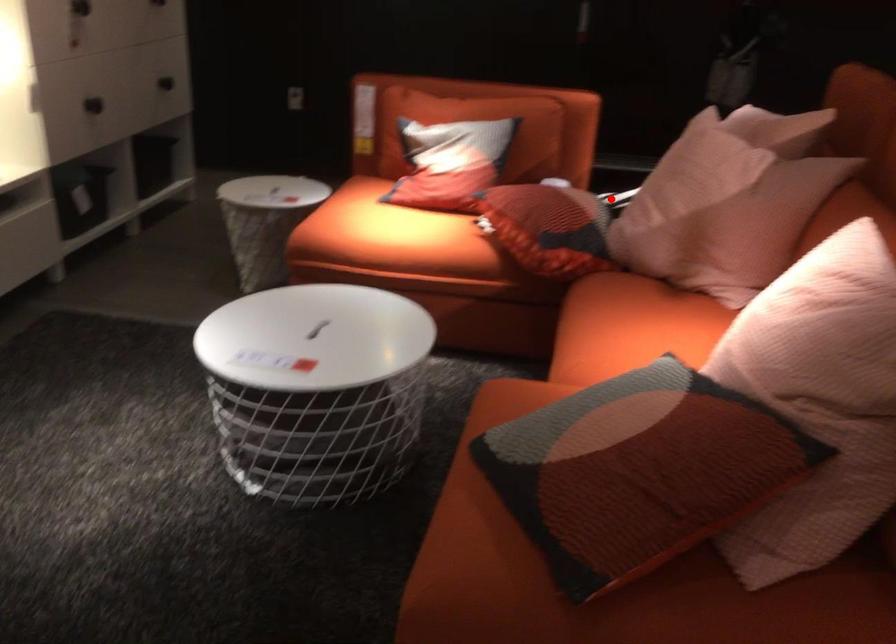
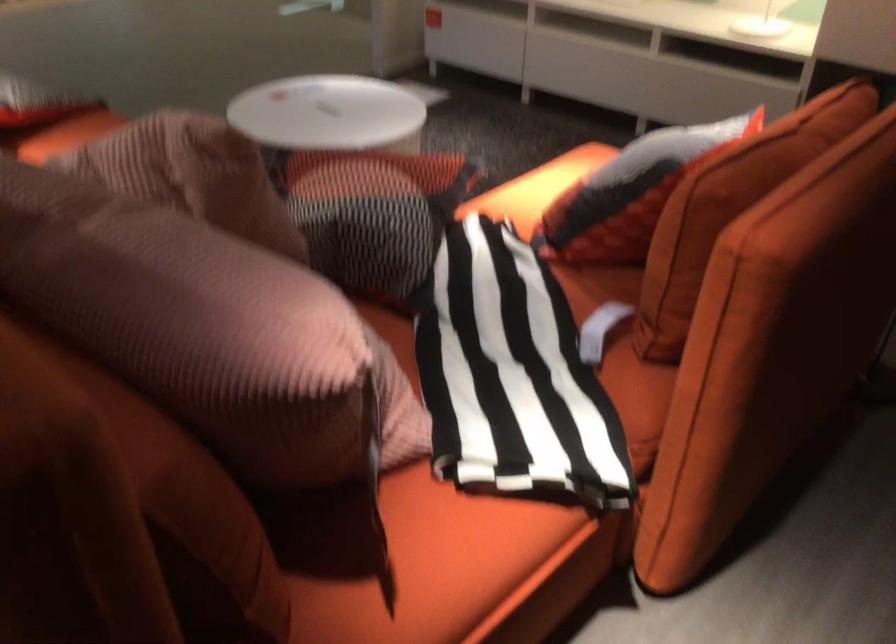
In the second image, find the point that corresponds to the highlighted location in the first image.

(512, 375)